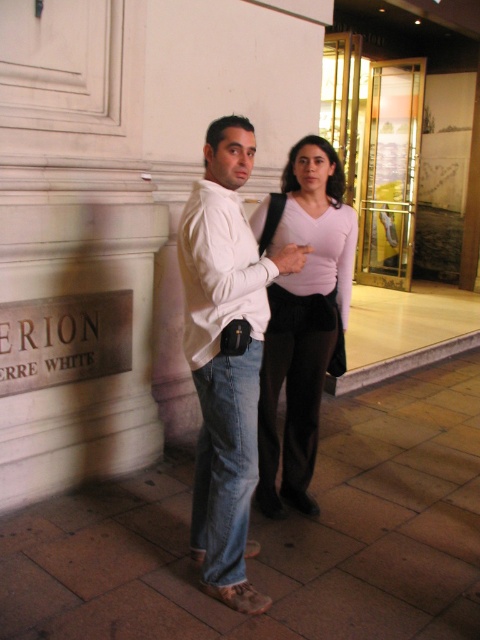
Does matte white shirt at center have a greater height compared to pink matte shirt at center?

Yes.

Locate an element on the screen. matte white shirt at center is located at coordinates (226, 355).

This screenshot has height=640, width=480. What do you see at coordinates (226, 355) in the screenshot?
I see `matte white shirt at center` at bounding box center [226, 355].

Who is positioned more to the right, matte white shirt at center or denim jeans at lower center?

matte white shirt at center is more to the right.

Locate an element on the screen. The image size is (480, 640). matte white shirt at center is located at coordinates (226, 355).

The height and width of the screenshot is (640, 480). I want to click on matte white shirt at center, so click(x=226, y=355).

Is pink matte shirt at center taller than denim jeans at lower center?

Indeed, pink matte shirt at center has a greater height compared to denim jeans at lower center.

Looking at this image, which is below, pink matte shirt at center or denim jeans at lower center?

denim jeans at lower center is below.

What do you see at coordinates (301, 316) in the screenshot?
I see `pink matte shirt at center` at bounding box center [301, 316].

This screenshot has width=480, height=640. Find the location of `pink matte shirt at center`. pink matte shirt at center is located at coordinates (301, 316).